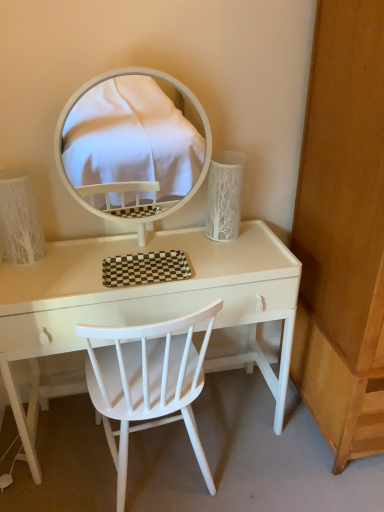
You are a GUI agent. You are given a task and a screenshot of the screen. Output one action in this format:
    pyautogui.click(x=<x>, y=<y>)
    Task: Click on the blank space to the left of white glossy mirror at upper center
    
    Given the screenshot: What is the action you would take?
    pyautogui.click(x=67, y=263)